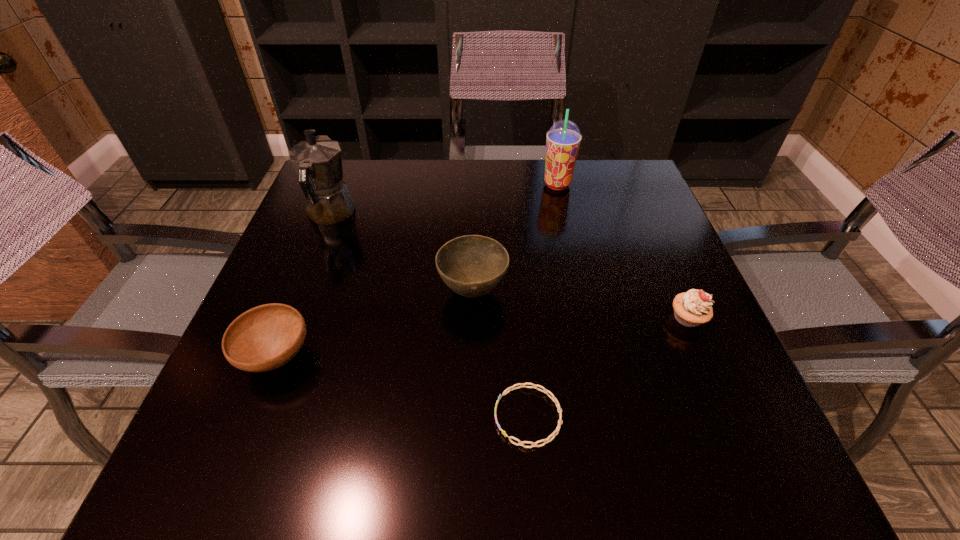
Locate an element on the screen. Image resolution: width=960 pixels, height=540 pixels. empty space that is in between the coffeepot and the smoothie is located at coordinates (444, 199).

Image resolution: width=960 pixels, height=540 pixels. Identify the location of vacant area between the cupcake and the bracelet. [x=608, y=367].

Where is `free space between the fifth object from left to right and the shorter bowl`? free space between the fifth object from left to right and the shorter bowl is located at coordinates (417, 271).

I want to click on free space between the smoothie and the taller bowl, so click(516, 238).

What are the coordinates of `free spot between the taller bowl and the nearer bowl` in the screenshot? It's located at pos(374,324).

Locate an element on the screen. vacant region between the coffeepot and the bracelet is located at coordinates (429, 315).

Where is `free spot between the cupcake and the shortest object`? The width and height of the screenshot is (960, 540). free spot between the cupcake and the shortest object is located at coordinates (608, 367).

This screenshot has width=960, height=540. In order to click on vacant region between the nearer bowl and the coffeepot in this screenshot , I will do `click(303, 285)`.

Identify which object is the closest to the bracelet. Please provide its 2D coordinates. Your answer should be formatted as a tuple, i.e. [(x, y)], where the tuple contains the x and y coordinates of a point satisfying the conditions above.

[(472, 265)]

Where is `object that is the third closest to the bracelet`? The image size is (960, 540). object that is the third closest to the bracelet is located at coordinates (266, 337).